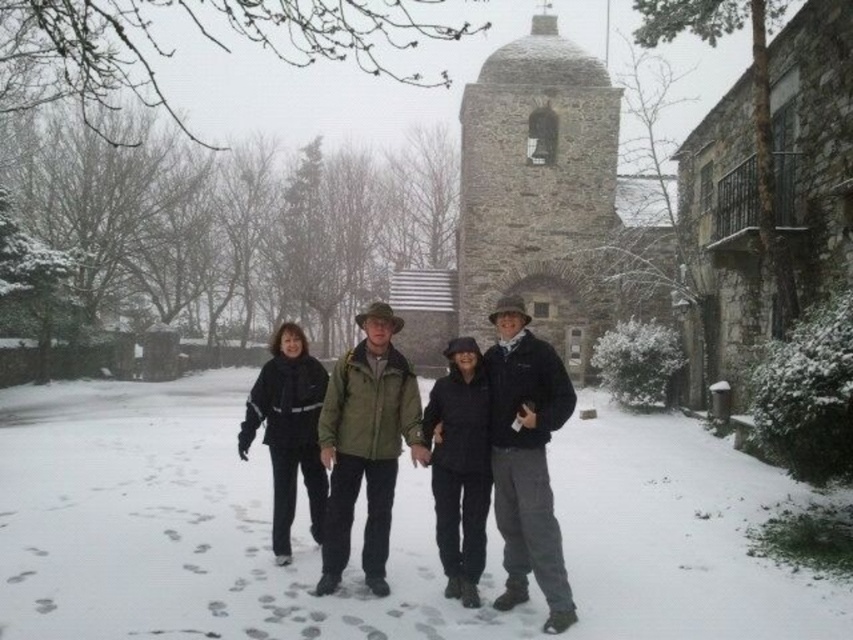
Question: Which of the following is the closest to the observer?

Choices:
 (A) black matte jacket at center
 (B) stone textured tower at center
 (C) dark green jacket at center

Answer: (C)

Question: Among these objects, which one is nearest to the camera?

Choices:
 (A) white powdery snow at center
 (B) black woolen coat at center
 (C) dark green jacket at center
 (D) green matte jacket at center

Answer: (A)

Question: Is green matte jacket at center wider than black matte jacket at center?

Choices:
 (A) yes
 (B) no

Answer: (B)

Question: Which object appears farthest from the camera in this image?

Choices:
 (A) black matte jacket at center
 (B) stone textured tower at center

Answer: (B)

Question: Considering the relative positions of black woolen coat at center and black matte jacket at center in the image provided, where is black woolen coat at center located with respect to black matte jacket at center?

Choices:
 (A) below
 (B) above

Answer: (A)

Question: Is white powdery snow at center to the left of green matte jacket at center from the viewer's perspective?

Choices:
 (A) no
 (B) yes

Answer: (B)